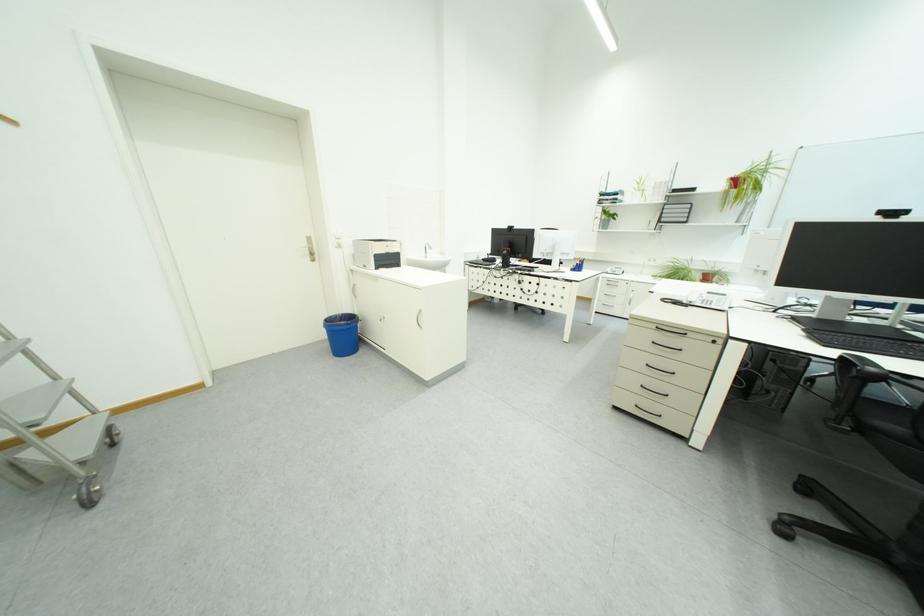
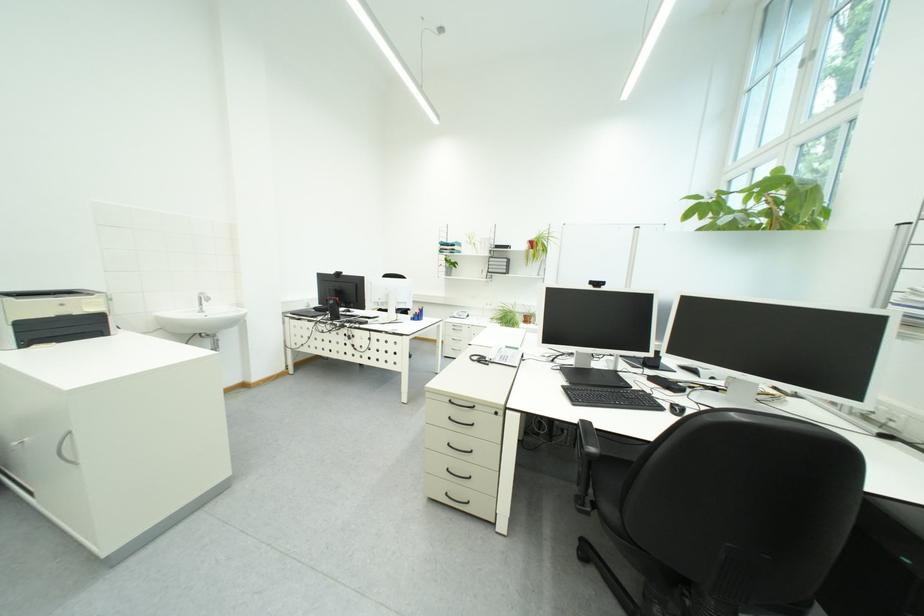
Locate, in the second image, the point that corresponds to the point at 796,411 in the first image.

(586, 446)